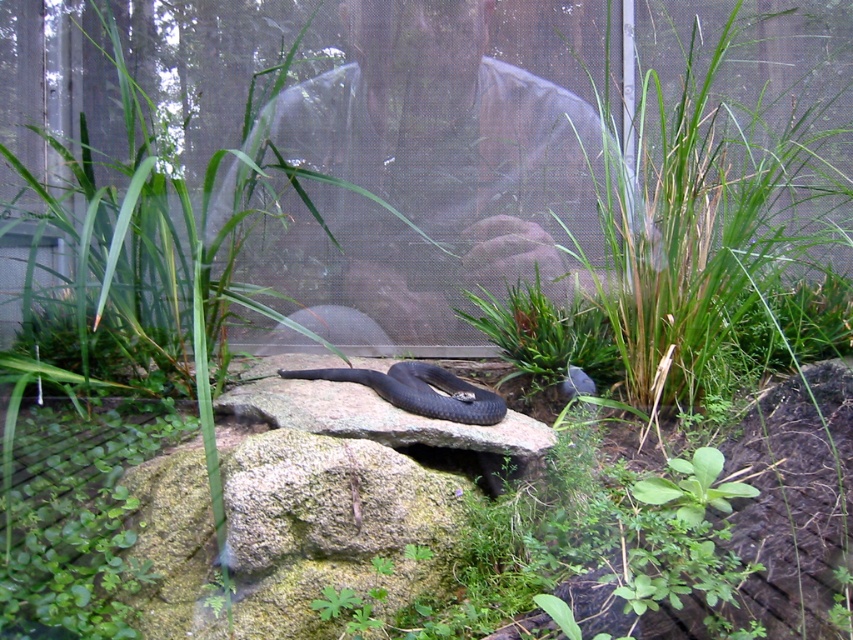
You are a small insect observing the scene from above. Which object is closer to you between the green grass at center and the shiny black snake at center?

The green grass at center is closer to you than the shiny black snake at center because it is positioned further away from the viewer.

You are a small insect in the terrarium. You want to hide from the shiny black snake at center. Can you hide under the green grass at center without being seen? Please explain.

The green grass at center might be wider than the shiny black snake at center, so there is a possibility that the grass could provide enough coverage to hide from the snake. However, the exact width difference isn not specified, so success depends on how much wider the grass is compared to the snake.